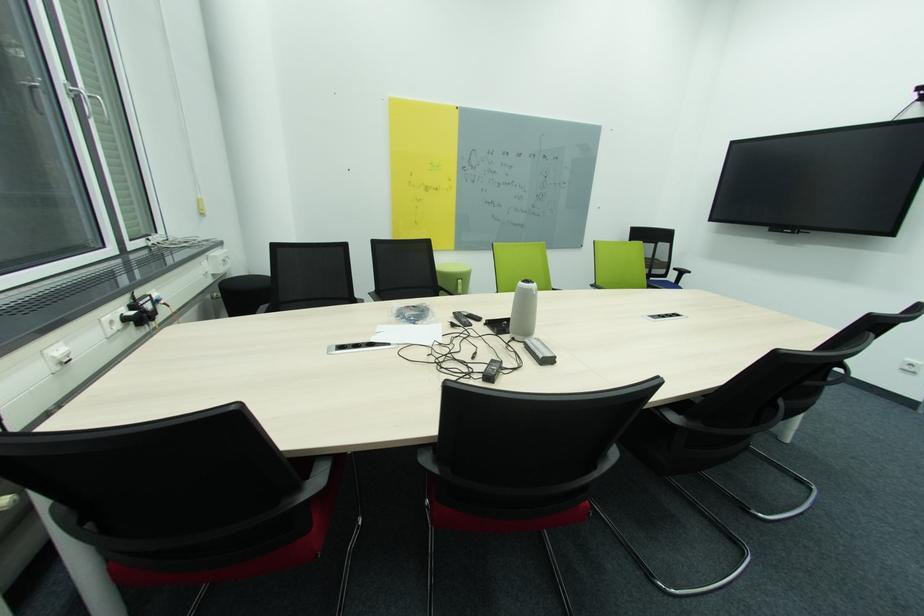
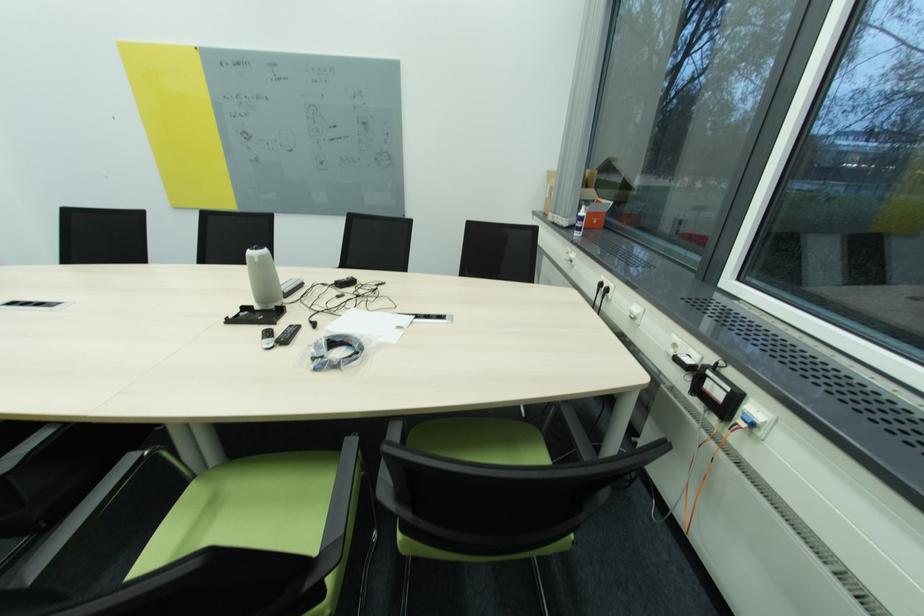
In the second image, find the point that corresponds to (x=116, y=323) in the first image.

(679, 346)